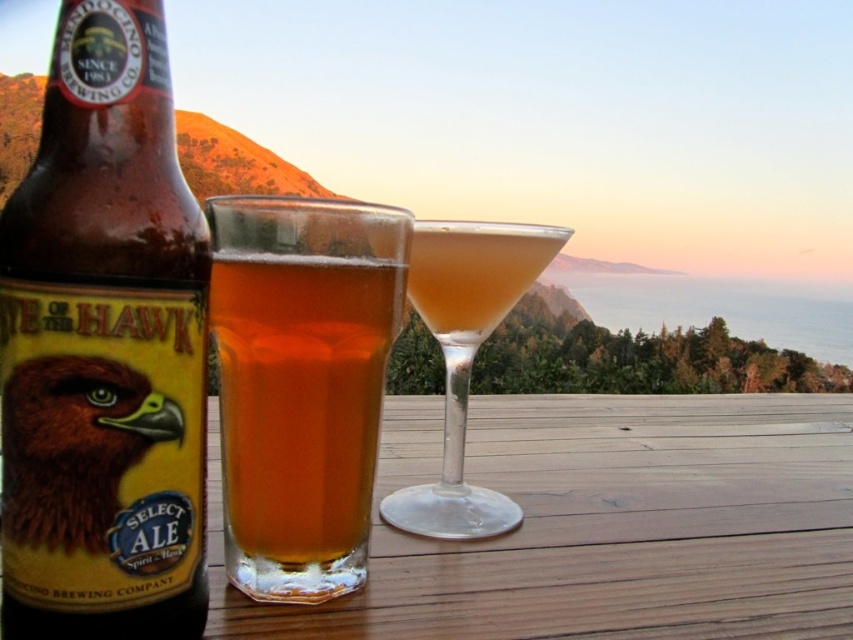
Question: Can you confirm if brown glass bottle at left is positioned above brown feathered eagle at lower left?

Choices:
 (A) yes
 (B) no

Answer: (A)

Question: Among these points, which one is nearest to the camera?

Choices:
 (A) (126, 230)
 (B) (531, 253)

Answer: (A)

Question: Is translucent glass beer at center smaller than brown feathered eagle at lower left?

Choices:
 (A) no
 (B) yes

Answer: (A)

Question: Considering the real-world distances, which object is farthest from the brown glass bottle at left?

Choices:
 (A) translucent glass cocktail at center
 (B) translucent glass beer at center

Answer: (A)

Question: Does brown glass bottle at left appear under translucent glass beer at center?

Choices:
 (A) yes
 (B) no

Answer: (B)

Question: Which object is positioned farthest from the translucent glass beer at center?

Choices:
 (A) brown feathered eagle at lower left
 (B) translucent glass cocktail at center
 (C) brown glass bottle at left

Answer: (B)